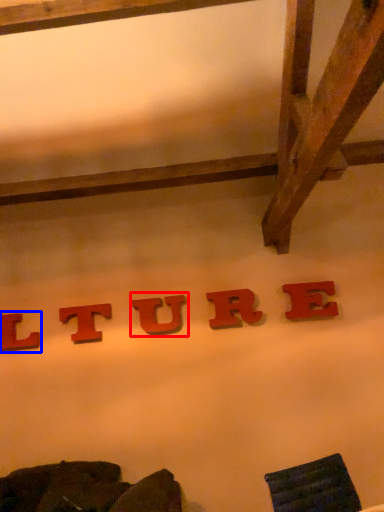
Question: Which object is closer to the camera taking this photo, letter (highlighted by a red box) or letter (highlighted by a blue box)?

Choices:
 (A) letter
 (B) letter

Answer: (A)